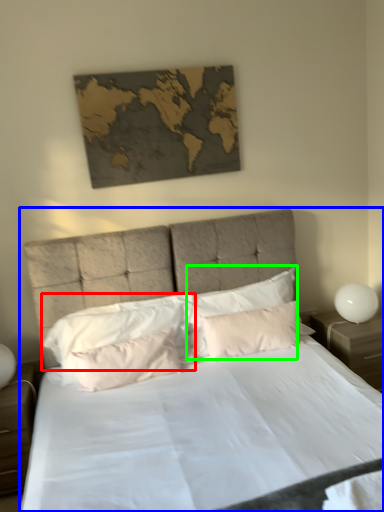
Question: Considering the real-world distances, which object is closest to pillow (highlighted by a red box)? bed (highlighted by a blue box) or pillow (highlighted by a green box).

Choices:
 (A) bed
 (B) pillow

Answer: (A)